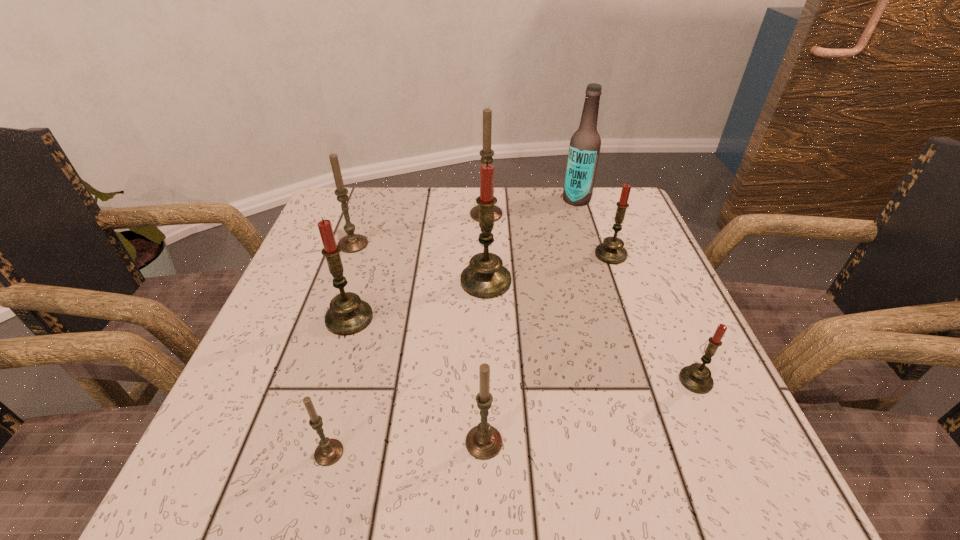
Locate which gray candle ranks second in proximity to the leftmost gray candle. Please provide its 2D coordinates. Your answer should be formatted as a tuple, i.e. [(x, y)], where the tuple contains the x and y coordinates of a point satisfying the conditions above.

[(329, 451)]

Where is `gray candle that stands as the third closest to the farthest gray candle`? Image resolution: width=960 pixels, height=540 pixels. gray candle that stands as the third closest to the farthest gray candle is located at coordinates click(x=329, y=451).

The width and height of the screenshot is (960, 540). Find the location of `free space that satisfies the following two spatial constraints: 1. on the back side of the smallest gray candle; 2. on the right side of the third red candle from right to left`. free space that satisfies the following two spatial constraints: 1. on the back side of the smallest gray candle; 2. on the right side of the third red candle from right to left is located at coordinates (375, 281).

Locate an element on the screen. The height and width of the screenshot is (540, 960). vacant area in the image that satisfies the following two spatial constraints: 1. on the side of the beer bottle with the label; 2. on the front side of the leftmost gray candle is located at coordinates (590, 244).

Locate an element on the screen. The width and height of the screenshot is (960, 540). free space that satisfies the following two spatial constraints: 1. on the side of the beer bottle with the label; 2. on the right side of the rightmost candle is located at coordinates (634, 381).